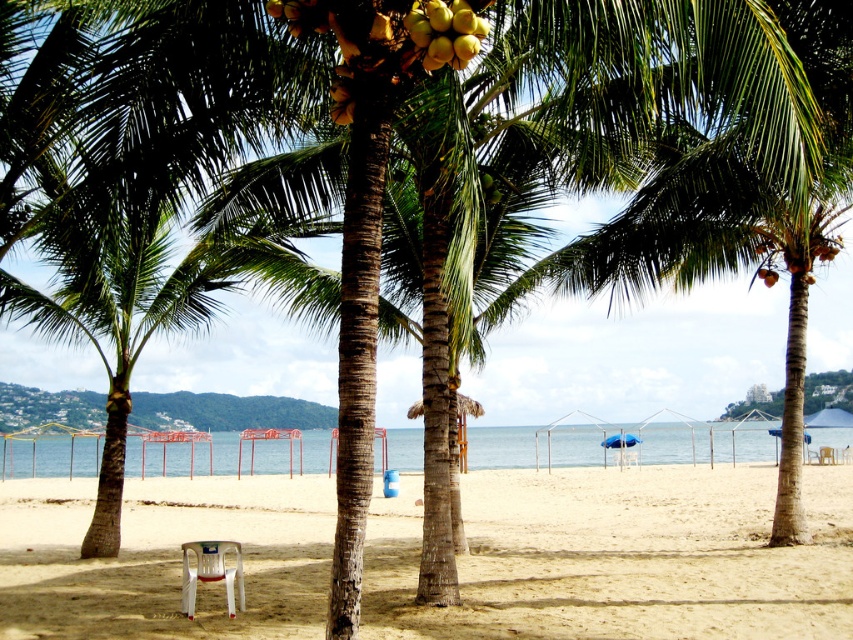
You are planning to set up a small picnic area near the beach. You have a yellow matte coconut at upper center and a white plastic chair at lower left. Which object is taller, and would it be suitable to use as a seat if needed?

The white plastic chair at lower left is taller than the yellow matte coconut at upper center. While the chair is designed for seating, the coconut is not suitable for sitting on as it is shorter and likely too small and unstable.

From the picture: You are a beachgoer sitting on the sand and looking at the yellow matte coconut at upper center and the white plastic chair at lower left. Which object is positioned to the right of the other?

The yellow matte coconut at upper center is to the right of the white plastic chair at lower left according to the description.